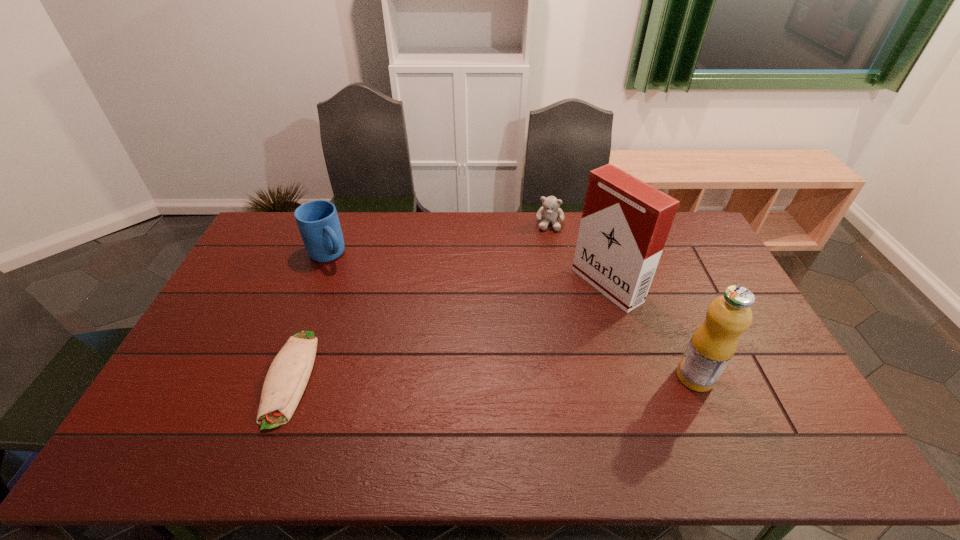
You are a GUI agent. You are given a task and a screenshot of the screen. Output one action in this format:
    pyautogui.click(x=<x>, y=<y>)
    Task: Click on the shortest object
    This screenshot has width=960, height=540.
    Given the screenshot: What is the action you would take?
    pyautogui.click(x=288, y=375)

Where is `the fourth shortest object`? The height and width of the screenshot is (540, 960). the fourth shortest object is located at coordinates (713, 344).

Image resolution: width=960 pixels, height=540 pixels. I want to click on fruit juice, so click(713, 344).

Where is `mug`? The width and height of the screenshot is (960, 540). mug is located at coordinates (318, 222).

Where is `the tallest object`? the tallest object is located at coordinates (625, 222).

You are a GUI agent. You are given a task and a screenshot of the screen. Output one action in this format:
    pyautogui.click(x=<x>, y=<y>)
    Task: Click on the teddy bear
    The image size is (960, 540).
    Given the screenshot: What is the action you would take?
    pyautogui.click(x=550, y=212)

I want to click on the farthest object, so click(550, 212).

Identify the location of free space located on the front label of the fourth shortest object. (530, 377).

Find the location of a particular element. The width and height of the screenshot is (960, 540). free region located on the front label of the fourth shortest object is located at coordinates (533, 377).

Locate an element on the screen. This screenshot has height=540, width=960. vacant region located on the front label of the fourth shortest object is located at coordinates pyautogui.click(x=647, y=377).